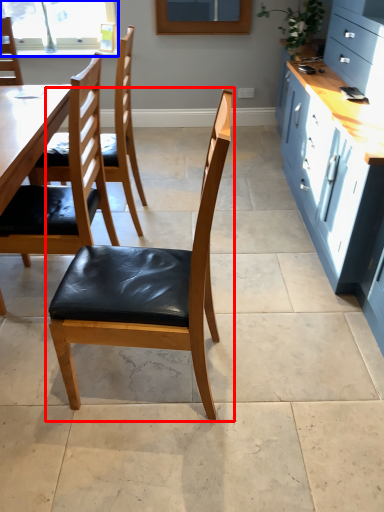
Question: Which of the following is the closest to the observer, chair (highlighted by a red box) or window (highlighted by a blue box)?

Choices:
 (A) chair
 (B) window

Answer: (A)